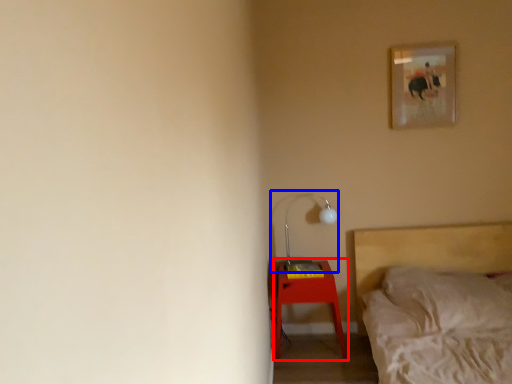
Question: Among these objects, which one is farthest to the camera, nightstand (highlighted by a red box) or table lamp (highlighted by a blue box)?

Choices:
 (A) nightstand
 (B) table lamp

Answer: (B)